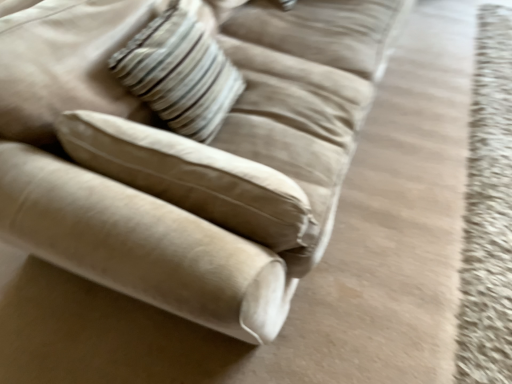
The height and width of the screenshot is (384, 512). Describe the element at coordinates (187, 153) in the screenshot. I see `suede beige couch at upper left` at that location.

Image resolution: width=512 pixels, height=384 pixels. What are the coordinates of `suede beige couch at upper left` in the screenshot? It's located at (187, 153).

This screenshot has width=512, height=384. What are the coordinates of `striped fabric pillow at upper center` in the screenshot? It's located at (180, 72).

The height and width of the screenshot is (384, 512). What do you see at coordinates (180, 72) in the screenshot?
I see `striped fabric pillow at upper center` at bounding box center [180, 72].

The height and width of the screenshot is (384, 512). Identify the location of suede beige couch at upper left. (187, 153).

Considering the relative positions of suede beige couch at upper left and striped fabric pillow at upper center in the image provided, is suede beige couch at upper left to the left or to the right of striped fabric pillow at upper center?

From the image, it's evident that suede beige couch at upper left is to the right of striped fabric pillow at upper center.

Relative to striped fabric pillow at upper center, is suede beige couch at upper left in front or behind?

suede beige couch at upper left is positioned closer to the viewer than striped fabric pillow at upper center.

Considering the points (371, 40) and (218, 89), which point is behind, point (371, 40) or point (218, 89)?

The point (371, 40) is more distant.

From the image's perspective, relative to striped fabric pillow at upper center, is suede beige couch at upper left above or below?

Clearly, from the image's perspective, suede beige couch at upper left is above striped fabric pillow at upper center.

From a real-world perspective, is suede beige couch at upper left physically below striped fabric pillow at upper center?

Correct, in the physical world, suede beige couch at upper left is lower than striped fabric pillow at upper center.

In terms of width, does suede beige couch at upper left look wider or thinner when compared to striped fabric pillow at upper center?

Considering their sizes, suede beige couch at upper left looks broader than striped fabric pillow at upper center.

Between suede beige couch at upper left and striped fabric pillow at upper center, which one has more height?

With more height is suede beige couch at upper left.

Can you confirm if suede beige couch at upper left is bigger than striped fabric pillow at upper center?

Correct, suede beige couch at upper left is larger in size than striped fabric pillow at upper center.

Is suede beige couch at upper left not inside striped fabric pillow at upper center?

That's correct, suede beige couch at upper left is outside of striped fabric pillow at upper center.

Is suede beige couch at upper left far from striped fabric pillow at upper center?

suede beige couch at upper left is near striped fabric pillow at upper center, not far away.

Is suede beige couch at upper left facing away from striped fabric pillow at upper center?

Yes.

How different are the orientations of suede beige couch at upper left and striped fabric pillow at upper center in degrees?

They differ by 6.85 degrees in their facing directions.

What are the coordinates of `pillow located behind the suede beige couch at upper left` in the screenshot? It's located at (180, 72).

Between striped fabric pillow at upper center and suede beige couch at upper left, which one appears on the left side from the viewer's perspective?

Positioned to the left is striped fabric pillow at upper center.

Is striped fabric pillow at upper center further to the viewer compared to suede beige couch at upper left?

Yes, the depth of striped fabric pillow at upper center is greater than that of suede beige couch at upper left.

Which is closer to the camera, (164, 89) or (91, 43)?

Point (164, 89).

From the image's perspective, which one is positioned higher, striped fabric pillow at upper center or suede beige couch at upper left?

suede beige couch at upper left, from the image's perspective.

From a real-world perspective, which object rests below the other?

suede beige couch at upper left, from a real-world perspective.

Considering the sizes of striped fabric pillow at upper center and suede beige couch at upper left in the image, is striped fabric pillow at upper center wider or thinner than suede beige couch at upper left?

Clearly, striped fabric pillow at upper center has less width compared to suede beige couch at upper left.

Is striped fabric pillow at upper center shorter than suede beige couch at upper left?

Yes, striped fabric pillow at upper center is shorter than suede beige couch at upper left.

Is striped fabric pillow at upper center smaller than suede beige couch at upper left?

Correct, striped fabric pillow at upper center occupies less space than suede beige couch at upper left.

Do you think striped fabric pillow at upper center is within suede beige couch at upper left, or outside of it?

striped fabric pillow at upper center is spatially positioned inside suede beige couch at upper left.

Is striped fabric pillow at upper center beside suede beige couch at upper left?

No, striped fabric pillow at upper center is not in contact with suede beige couch at upper left.

Could you tell me if striped fabric pillow at upper center is turned towards suede beige couch at upper left?

Yes, striped fabric pillow at upper center is aimed at suede beige couch at upper left.

Can you tell me how much striped fabric pillow at upper center and suede beige couch at upper left differ in facing direction?

They differ by 6.85 degrees in their facing directions.

Find the location of a particular element. The height and width of the screenshot is (384, 512). pillow below the suede beige couch at upper left (from the image's perspective) is located at coordinates (180, 72).

The image size is (512, 384). In the image, there is a striped fabric pillow at upper center. Find the location of `studio couch above it (from the image's perspective)`. studio couch above it (from the image's perspective) is located at coordinates (187, 153).

I want to click on studio couch on the right of striped fabric pillow at upper center, so click(187, 153).